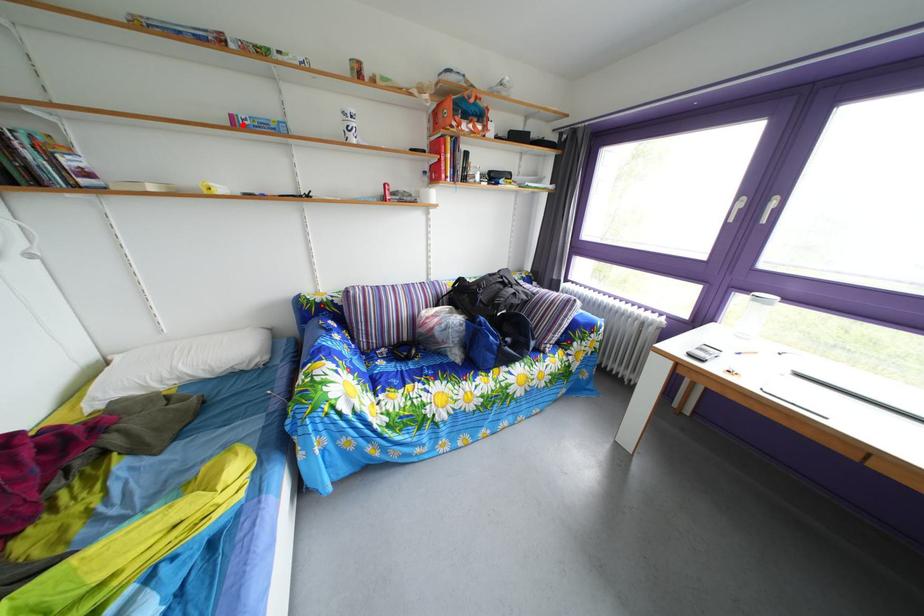
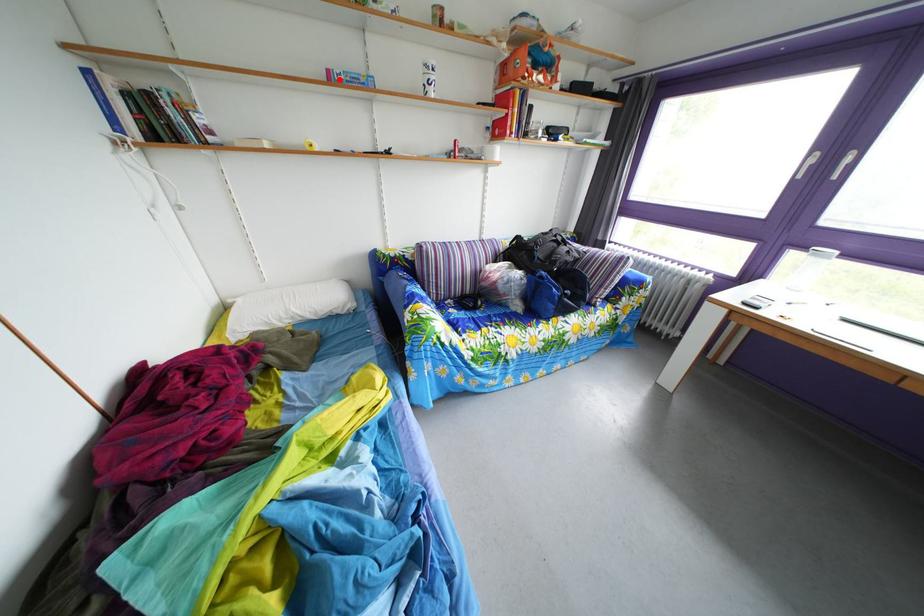
I am providing you with two images of the same scene from different viewpoints. A red point is marked on the first image and another point is marked on the second image. Does the point marked in image1 correspond to the same location as the one in image2?

Yes